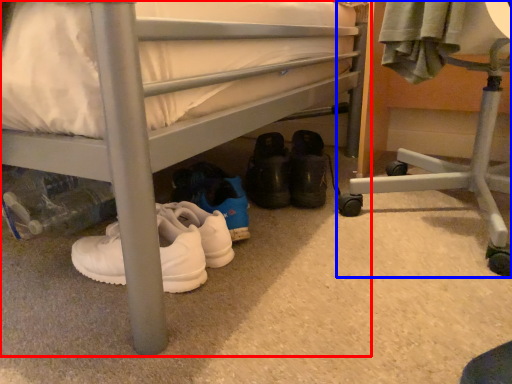
Question: Which of the following is the farthest to the observer, bed (highlighted by a red box) or furniture (highlighted by a blue box)?

Choices:
 (A) bed
 (B) furniture

Answer: (B)